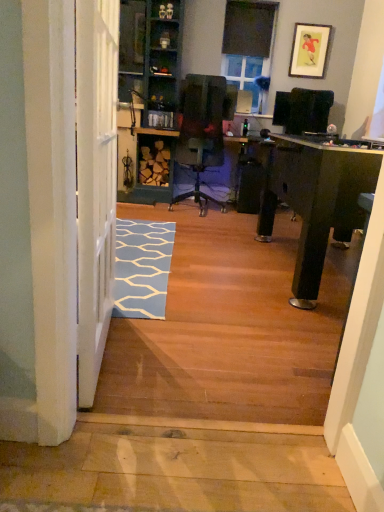
Question: Does black matte window screen at upper center, the first window screen positioned from the front, come in front of clear glass window screen at upper center, the 1th window screen positioned from the back?

Choices:
 (A) yes
 (B) no

Answer: (A)

Question: Considering the relative sizes of black matte window screen at upper center, the first window screen positioned from the front, and clear glass window screen at upper center, the first window screen from the bottom, in the image provided, is black matte window screen at upper center, the first window screen positioned from the front, smaller than clear glass window screen at upper center, the first window screen from the bottom,?

Choices:
 (A) yes
 (B) no

Answer: (A)

Question: From the image's perspective, is black matte window screen at upper center, arranged as the first window screen when viewed from the top, beneath clear glass window screen at upper center, which ranks as the 2th window screen in front-to-back order?

Choices:
 (A) no
 (B) yes

Answer: (A)

Question: Does black matte window screen at upper center, the first window screen positioned from the front, have a lesser width compared to clear glass window screen at upper center, the first window screen from the bottom?

Choices:
 (A) yes
 (B) no

Answer: (A)

Question: Is black matte window screen at upper center, the second window screen when ordered from back to front, taller than clear glass window screen at upper center, the second window screen positioned from the top?

Choices:
 (A) yes
 (B) no

Answer: (B)

Question: Considering the relative sizes of black matte window screen at upper center, which is the 2th window screen in bottom-to-top order, and clear glass window screen at upper center, which ranks as the 2th window screen in front-to-back order, in the image provided, is black matte window screen at upper center, which is the 2th window screen in bottom-to-top order, wider than clear glass window screen at upper center, which ranks as the 2th window screen in front-to-back order,?

Choices:
 (A) yes
 (B) no

Answer: (B)

Question: From the image's perspective, would you say black matte window screen at upper center, the second window screen when ordered from back to front, is positioned over green painted wood bookshelf at center?

Choices:
 (A) no
 (B) yes

Answer: (B)

Question: Does black matte window screen at upper center, the second window screen when ordered from back to front, lie behind green painted wood bookshelf at center?

Choices:
 (A) yes
 (B) no

Answer: (A)

Question: Are black matte window screen at upper center, the first window screen positioned from the front, and green painted wood bookshelf at center located far from each other?

Choices:
 (A) yes
 (B) no

Answer: (A)

Question: Can you confirm if black matte window screen at upper center, the second window screen when ordered from back to front, is shorter than green painted wood bookshelf at center?

Choices:
 (A) no
 (B) yes

Answer: (B)

Question: Is black matte window screen at upper center, the first window screen positioned from the front, located outside green painted wood bookshelf at center?

Choices:
 (A) yes
 (B) no

Answer: (A)

Question: Does black matte window screen at upper center, arranged as the first window screen when viewed from the top, come in front of green painted wood bookshelf at center?

Choices:
 (A) yes
 (B) no

Answer: (B)

Question: Does black matte window screen at upper center, which is the 2th window screen in bottom-to-top order, have a greater height compared to blue carpet at lower left?

Choices:
 (A) yes
 (B) no

Answer: (A)